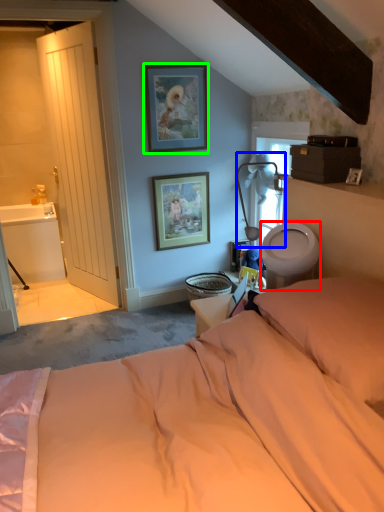
Question: Considering the real-world distances, which object is closest to toilet bowl (highlighted by a red box)? table lamp (highlighted by a blue box) or picture frame (highlighted by a green box).

Choices:
 (A) table lamp
 (B) picture frame

Answer: (A)